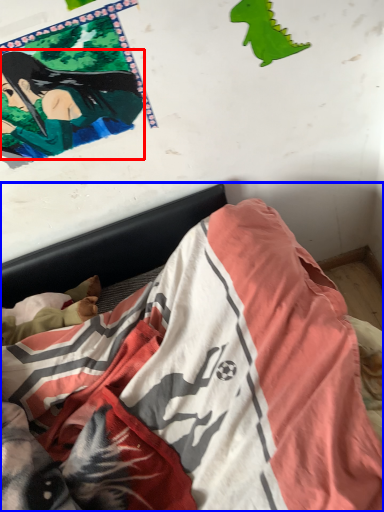
Question: Among these objects, which one is nearest to the camera, person (highlighted by a red box) or bed (highlighted by a blue box)?

Choices:
 (A) person
 (B) bed

Answer: (B)